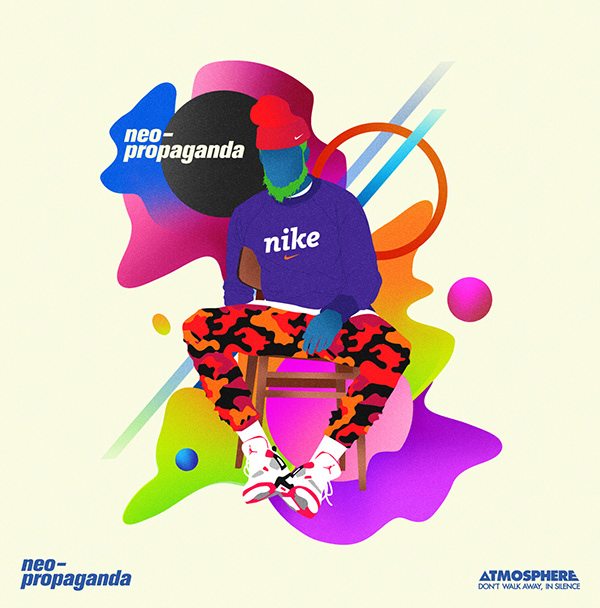
Locate an element on the screen. This screenshot has width=600, height=608. wooden stool is located at coordinates [x=260, y=367].